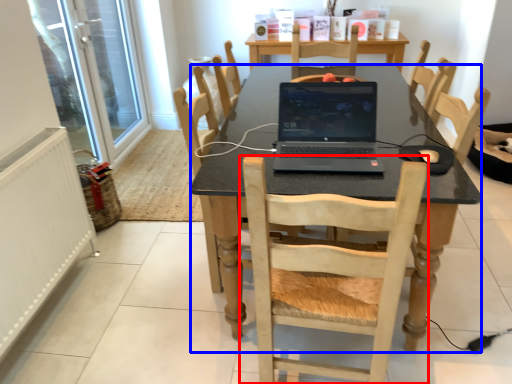
Question: Which point is further to the camera, chair (highlighted by a red box) or desk (highlighted by a blue box)?

Choices:
 (A) chair
 (B) desk

Answer: (B)